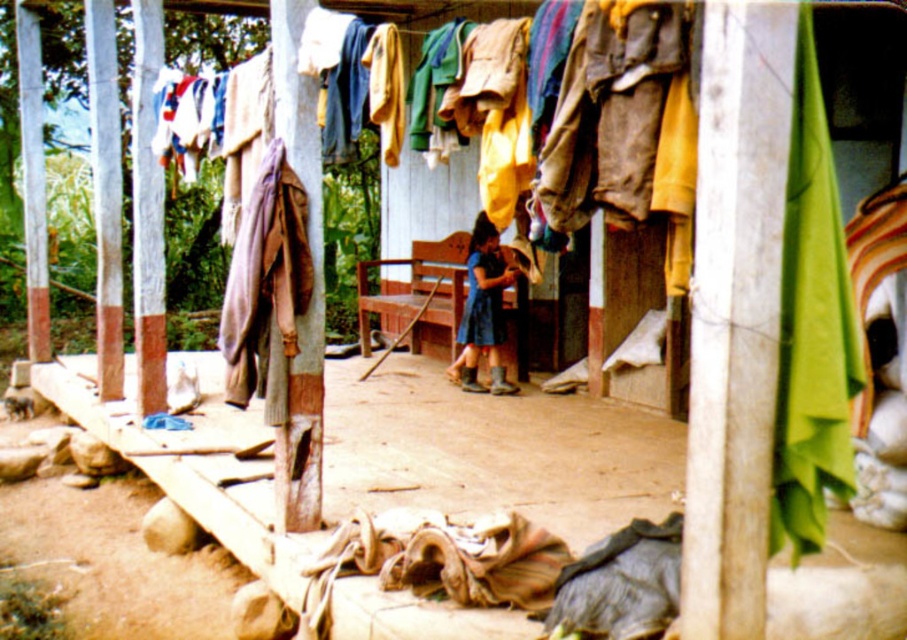
Who is higher up, blue denim dress at center or blue fabric dress at center?

blue fabric dress at center is higher up.

Describe the element at coordinates (483, 312) in the screenshot. I see `blue denim dress at center` at that location.

This screenshot has height=640, width=907. I want to click on blue denim dress at center, so click(x=483, y=312).

Is point (283, 252) behind point (499, 332)?

No, it is in front of (499, 332).

Does knitted wool sweater at center appear on the right side of blue fabric dress at center?

No, knitted wool sweater at center is not to the right of blue fabric dress at center.

Where is `knitted wool sweater at center`? Image resolution: width=907 pixels, height=640 pixels. knitted wool sweater at center is located at coordinates (266, 289).

Is the position of knitted wool sweater at center less distant than that of blue denim dress at center?

Yes, knitted wool sweater at center is closer to the viewer.

Locate an element on the screen. The height and width of the screenshot is (640, 907). knitted wool sweater at center is located at coordinates (266, 289).